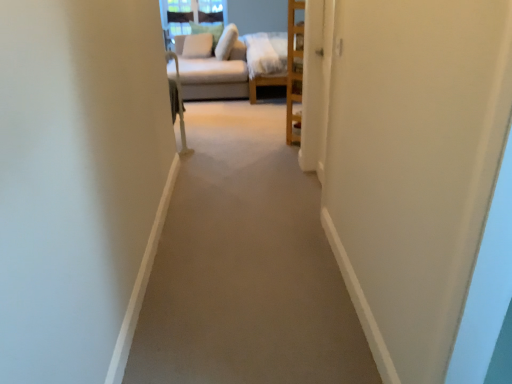
In order to click on light beige fabric pillow at upper center, the second pillow viewed from the left in this screenshot , I will do `click(208, 31)`.

What is the approximate height of carpet at center?

carpet at center is 1.61 inches tall.

This screenshot has width=512, height=384. I want to click on white soft pillow at upper center, which is the 1th pillow from right to left, so click(226, 42).

Where is `light beige fabric pillow at upper center, the second pillow viewed from the left`? The image size is (512, 384). light beige fabric pillow at upper center, the second pillow viewed from the left is located at coordinates (208, 31).

Is white soft pillow at upper center, the 1th pillow from the left, aimed at beige fabric couch at upper center?

Yes, white soft pillow at upper center, the 1th pillow from the left, is facing beige fabric couch at upper center.

From a real-world perspective, is white soft pillow at upper center, the 1th pillow from the left, under beige fabric couch at upper center?

No.

Locate an element on the screen. The height and width of the screenshot is (384, 512). path in front of the white soft pillow at upper center, the 3th pillow viewed from the right is located at coordinates (245, 266).

From the image's perspective, which is below, carpet at center or white soft pillow at upper center, the 3th pillow viewed from the right?

carpet at center.

Are carpet at center and white soft pillow at upper center, the 3th pillow viewed from the right, far apart?

carpet at center is far away from white soft pillow at upper center, the 3th pillow viewed from the right.

Is carpet at center oriented towards white soft pillow at upper center, the 3th pillow viewed from the right?

No, carpet at center is not aimed at white soft pillow at upper center, the 3th pillow viewed from the right.

Is point (187, 46) closer or farther from the camera than point (228, 276)?

Point (187, 46) is positioned farther from the camera compared to point (228, 276).

Looking at this image, in terms of width, does white soft pillow at upper center, the 3th pillow viewed from the right, look wider or thinner when compared to carpet at center?

white soft pillow at upper center, the 3th pillow viewed from the right, is thinner than carpet at center.

Does white soft pillow at upper center, the 1th pillow from the left, turn towards carpet at center?

Yes, white soft pillow at upper center, the 1th pillow from the left, faces towards carpet at center.

Could you measure the distance between light beige fabric pillow at upper center, which ranks as the second pillow in right-to-left order, and white soft pillow at upper center, the 1th pillow from the left?

The distance of light beige fabric pillow at upper center, which ranks as the second pillow in right-to-left order, from white soft pillow at upper center, the 1th pillow from the left, is 5.42 inches.

Is light beige fabric pillow at upper center, which ranks as the second pillow in right-to-left order, turned away from white soft pillow at upper center, the 3th pillow viewed from the right?

That's right, light beige fabric pillow at upper center, which ranks as the second pillow in right-to-left order, is facing away from white soft pillow at upper center, the 3th pillow viewed from the right.

Considering the relative positions of light beige fabric pillow at upper center, which ranks as the second pillow in right-to-left order, and white soft pillow at upper center, the 1th pillow from the left, in the image provided, is light beige fabric pillow at upper center, which ranks as the second pillow in right-to-left order, to the left or to the right of white soft pillow at upper center, the 1th pillow from the left,?

From the image, it's evident that light beige fabric pillow at upper center, which ranks as the second pillow in right-to-left order, is to the right of white soft pillow at upper center, the 1th pillow from the left.

Is light beige fabric pillow at upper center, the second pillow viewed from the left, closer to camera compared to white soft pillow at upper center, the 3th pillow viewed from the right?

No, it is behind white soft pillow at upper center, the 3th pillow viewed from the right.

Locate an element on the screen. the 1st pillow behind the beige fabric couch at upper center is located at coordinates (226, 42).

How much distance is there between white soft pillow at upper center, placed as the third pillow when sorted from left to right, and beige fabric couch at upper center?

white soft pillow at upper center, placed as the third pillow when sorted from left to right, and beige fabric couch at upper center are 51.34 centimeters apart from each other.

From the image's perspective, is white soft pillow at upper center, which is the 1th pillow from right to left, over beige fabric couch at upper center?

Yes, from the image's perspective, white soft pillow at upper center, which is the 1th pillow from right to left, is over beige fabric couch at upper center.

In terms of width, does white soft pillow at upper center, which is the 1th pillow from right to left, look wider or thinner when compared to beige fabric couch at upper center?

Considering their sizes, white soft pillow at upper center, which is the 1th pillow from right to left, looks slimmer than beige fabric couch at upper center.

Is white soft pillow at upper center, the 1th pillow from the left, at the right side of white soft pillow at upper center, which is the 1th pillow from right to left?

Incorrect, white soft pillow at upper center, the 1th pillow from the left, is not on the right side of white soft pillow at upper center, which is the 1th pillow from right to left.

In the scene shown: Which object is further away from the camera taking this photo, white soft pillow at upper center, the 1th pillow from the left, or white soft pillow at upper center, placed as the third pillow when sorted from left to right?

white soft pillow at upper center, the 1th pillow from the left.

Considering the sizes of objects white soft pillow at upper center, the 1th pillow from the left, and white soft pillow at upper center, placed as the third pillow when sorted from left to right, in the image provided, who is smaller, white soft pillow at upper center, the 1th pillow from the left, or white soft pillow at upper center, placed as the third pillow when sorted from left to right,?

With smaller size is white soft pillow at upper center, the 1th pillow from the left.

Is point (189, 267) in front of point (217, 27)?

Yes.

Considering the relative positions of carpet at center and light beige fabric pillow at upper center, the second pillow viewed from the left, in the image provided, is carpet at center to the left of light beige fabric pillow at upper center, the second pillow viewed from the left, from the viewer's perspective?

Incorrect, carpet at center is not on the left side of light beige fabric pillow at upper center, the second pillow viewed from the left.

Does carpet at center lie behind light beige fabric pillow at upper center, which ranks as the second pillow in right-to-left order?

That is False.

The width and height of the screenshot is (512, 384). In order to click on studio couch below the white soft pillow at upper center, the 3th pillow viewed from the right (from the image's perspective) in this screenshot , I will do `click(231, 69)`.

Where is `the 3rd pillow to the left of the carpet at center, starting your count from the anchor`? The height and width of the screenshot is (384, 512). the 3rd pillow to the left of the carpet at center, starting your count from the anchor is located at coordinates (198, 46).

Estimate the real-world distances between objects in this image. Which object is further from light beige fabric pillow at upper center, the second pillow viewed from the left, beige fabric couch at upper center or carpet at center?

carpet at center lies further to light beige fabric pillow at upper center, the second pillow viewed from the left, than the other object.

Based on their spatial positions, is light beige fabric pillow at upper center, the second pillow viewed from the left, or carpet at center closer to white soft pillow at upper center, which is the 1th pillow from right to left?

light beige fabric pillow at upper center, the second pillow viewed from the left, is closer to white soft pillow at upper center, which is the 1th pillow from right to left.

Looking at the image, which one is located further to carpet at center, white soft pillow at upper center, placed as the third pillow when sorted from left to right, or beige fabric couch at upper center?

white soft pillow at upper center, placed as the third pillow when sorted from left to right, lies further to carpet at center than the other object.

When comparing their distances from carpet at center, does beige fabric couch at upper center or white soft pillow at upper center, the 3th pillow viewed from the right, seem closer?

Based on the image, beige fabric couch at upper center appears to be nearer to carpet at center.

When comparing their distances from white soft pillow at upper center, which is the 1th pillow from right to left, does carpet at center or light beige fabric pillow at upper center, which ranks as the second pillow in right-to-left order, seem closer?

Based on the image, light beige fabric pillow at upper center, which ranks as the second pillow in right-to-left order, appears to be nearer to white soft pillow at upper center, which is the 1th pillow from right to left.

Consider the image. Estimate the real-world distances between objects in this image. Which object is closer to beige fabric couch at upper center, white soft pillow at upper center, the 1th pillow from the left, or light beige fabric pillow at upper center, the second pillow viewed from the left?

Among the two, white soft pillow at upper center, the 1th pillow from the left, is located nearer to beige fabric couch at upper center.

When comparing their distances from white soft pillow at upper center, the 3th pillow viewed from the right, does carpet at center or light beige fabric pillow at upper center, which ranks as the second pillow in right-to-left order, seem closer?

Among the two, light beige fabric pillow at upper center, which ranks as the second pillow in right-to-left order, is located nearer to white soft pillow at upper center, the 3th pillow viewed from the right.

Based on their spatial positions, is beige fabric couch at upper center or light beige fabric pillow at upper center, the second pillow viewed from the left, further from white soft pillow at upper center, the 1th pillow from the left?

beige fabric couch at upper center is further to white soft pillow at upper center, the 1th pillow from the left.

Where is `pillow between carpet at center and white soft pillow at upper center, the 1th pillow from the left, from front to back`? pillow between carpet at center and white soft pillow at upper center, the 1th pillow from the left, from front to back is located at coordinates (226, 42).

Find the location of a particular element. This screenshot has height=384, width=512. pillow between beige fabric couch at upper center and white soft pillow at upper center, the 3th pillow viewed from the right, in the front-back direction is located at coordinates (226, 42).

Identify the location of studio couch between carpet at center and light beige fabric pillow at upper center, which ranks as the second pillow in right-to-left order, in the front-back direction. (231, 69).

This screenshot has width=512, height=384. In order to click on pillow between white soft pillow at upper center, the 3th pillow viewed from the right, and white soft pillow at upper center, which is the 1th pillow from right to left, from left to right in this screenshot , I will do click(208, 31).